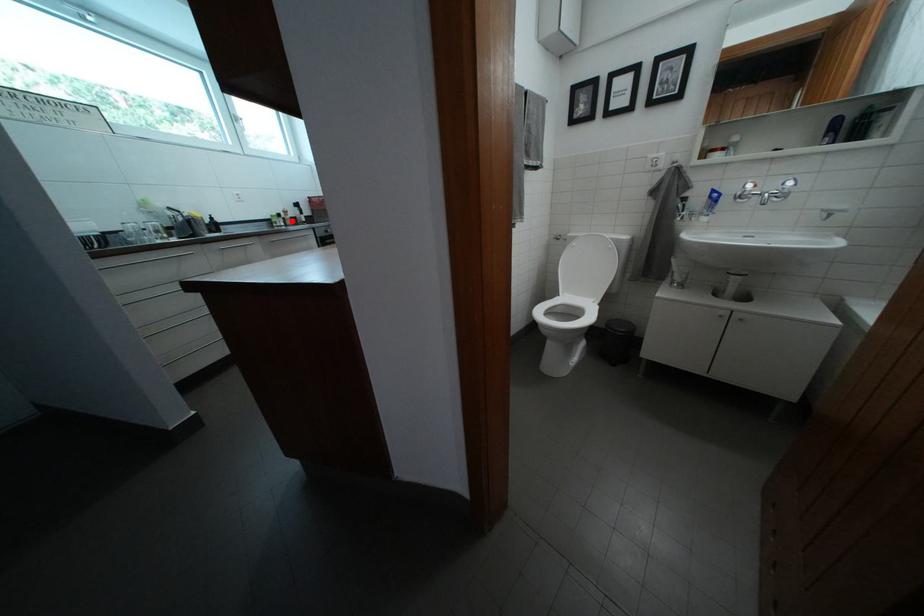
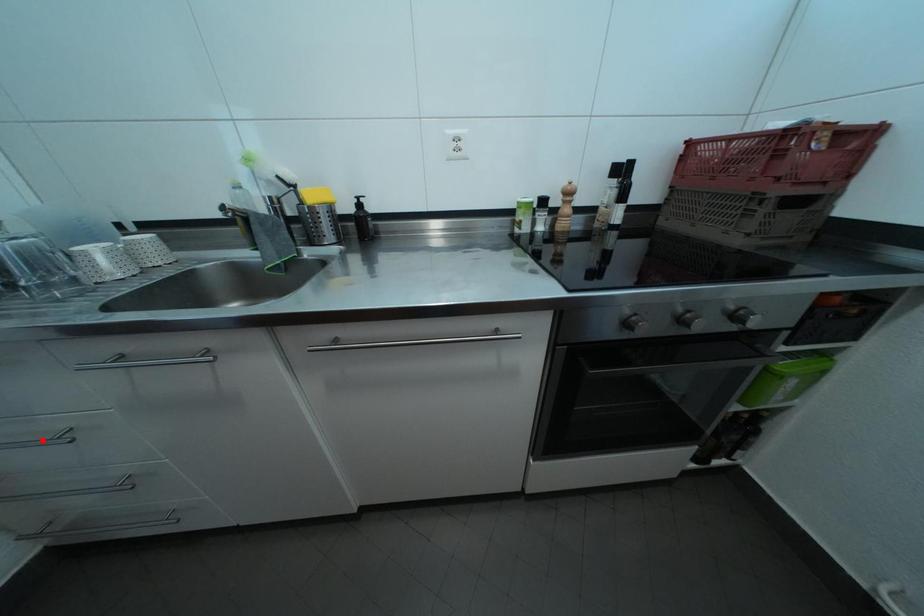
I am providing you with two images of the same scene from different viewpoints. A red point is marked on the first image and another point is marked on the second image. Is the red point in image1 aligned with the point shown in image2?

No